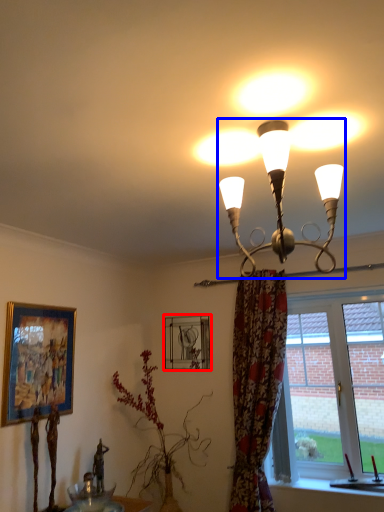
Question: Among these objects, which one is nearest to the camera, picture frame (highlighted by a red box) or lamp (highlighted by a blue box)?

Choices:
 (A) picture frame
 (B) lamp

Answer: (B)